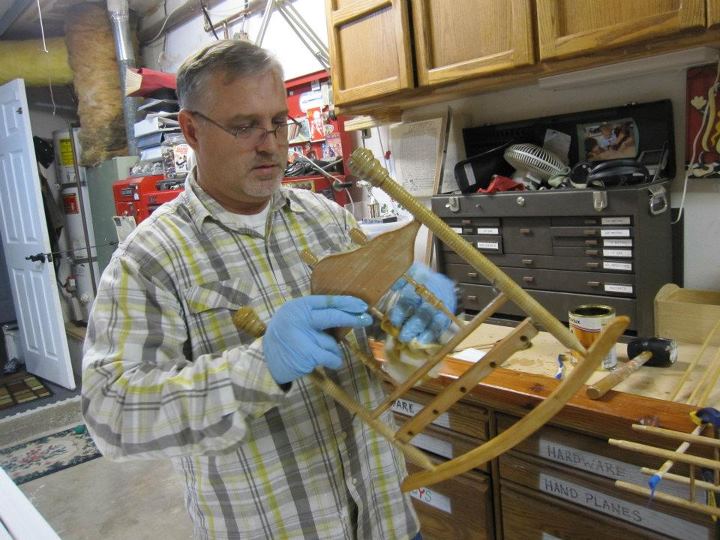
Find the location of a particular element. This screenshot has width=720, height=540. carpet is located at coordinates (60, 455).